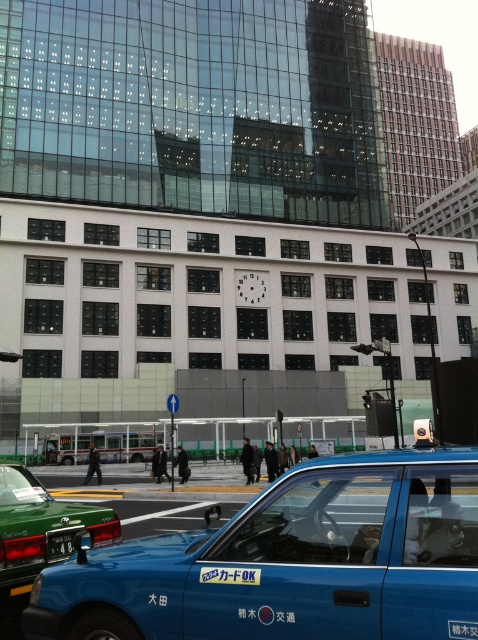
You are a delivery person who needs to load a package into the trunk of the blue matte taxi at lower center. The green matte license plate at lower left is blocking the trunk. Is there enough space between them to open the trunk?

The blue matte taxi at lower center and the green matte license plate at lower left are 5.10 feet apart from each other. Since the distance between them is sufficient, the trunk can be opened without any obstruction from the license plate.

Consider the image. You are standing at the entrance of the large modern building and want to hail a taxi. Based on the image, where is the blue matte taxi at lower center relative to your position?

The blue matte taxi at lower center is located at point 0.880 on the x axis and 0.611 on the y axis relative to your position at the building entrance.

You are a delivery person needing to place a package in the trunk of the blue matte taxi at lower center. However, there is a green matte taxi at lower left blocking access. Given that the delivery robot is 1.5 meters wide, can it navigate between the two taxis to reach the trunk?

The distance between the blue matte taxi at lower center and green matte taxi at lower left is 1.73 meters. Since the robot is 1.5 meters wide, it can fit through the space between them to reach the trunk of the blue matte taxi at lower center.